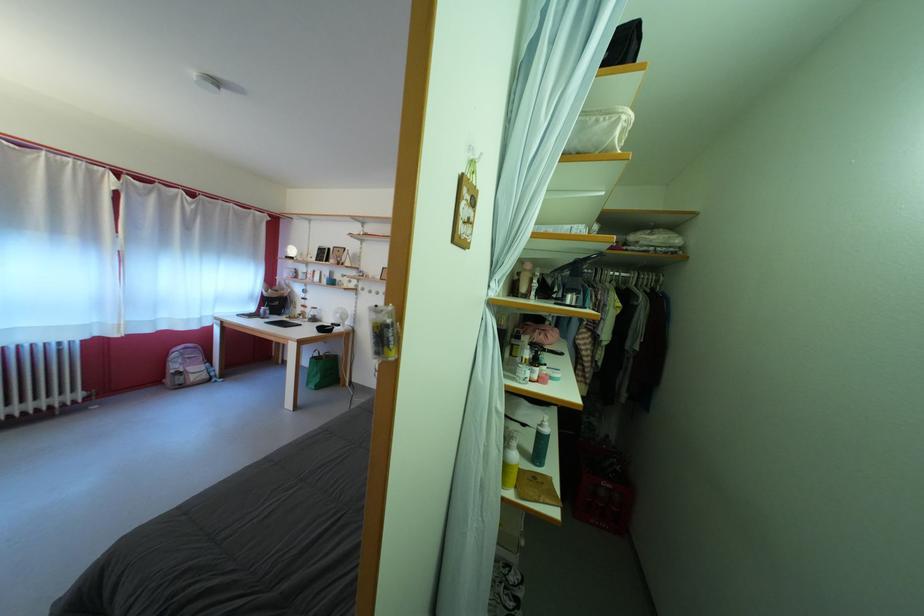
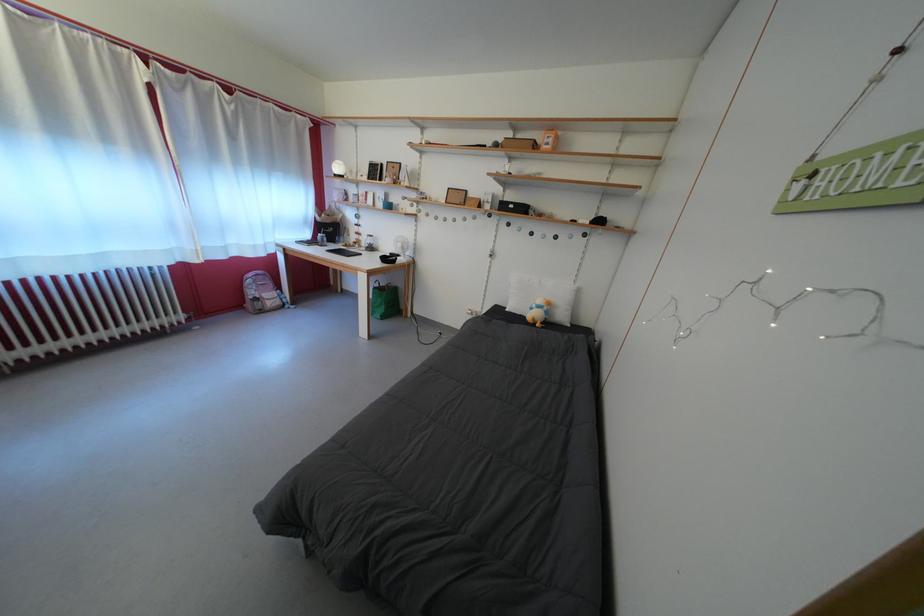
The point at [346,322] is marked in the first image. Where is the corresponding point in the second image?

(407, 251)